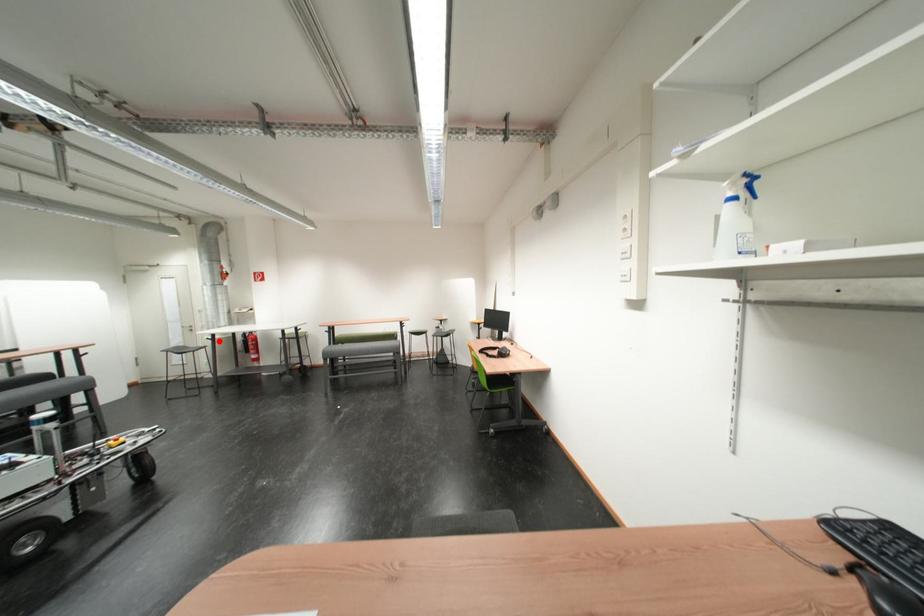
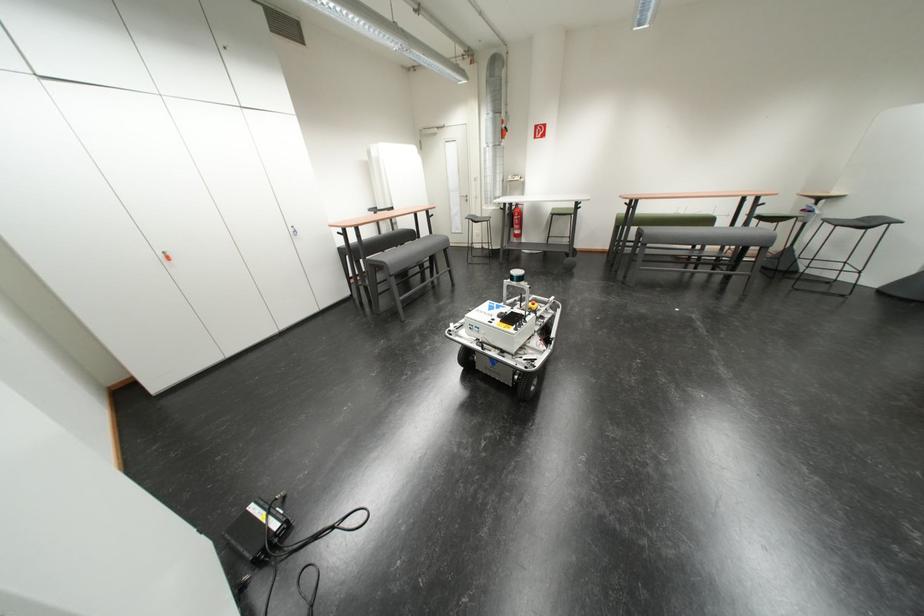
Question: I am providing you with two images of the same scene from different viewpoints. A red point is shown in image1. For the corresponding object point in image2, is it positioned nearer or farther from the camera?

Choices:
 (A) Nearer
 (B) Farther

Answer: (A)